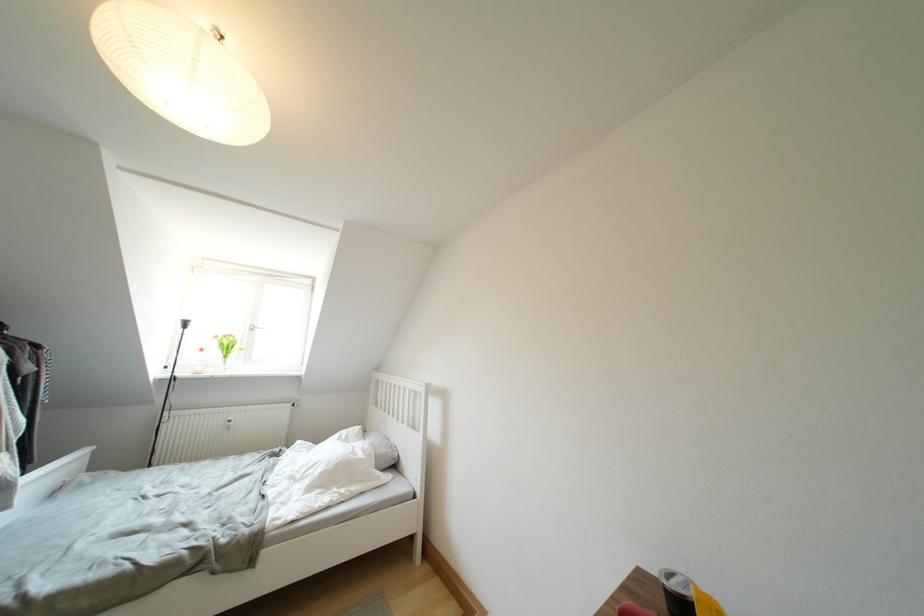
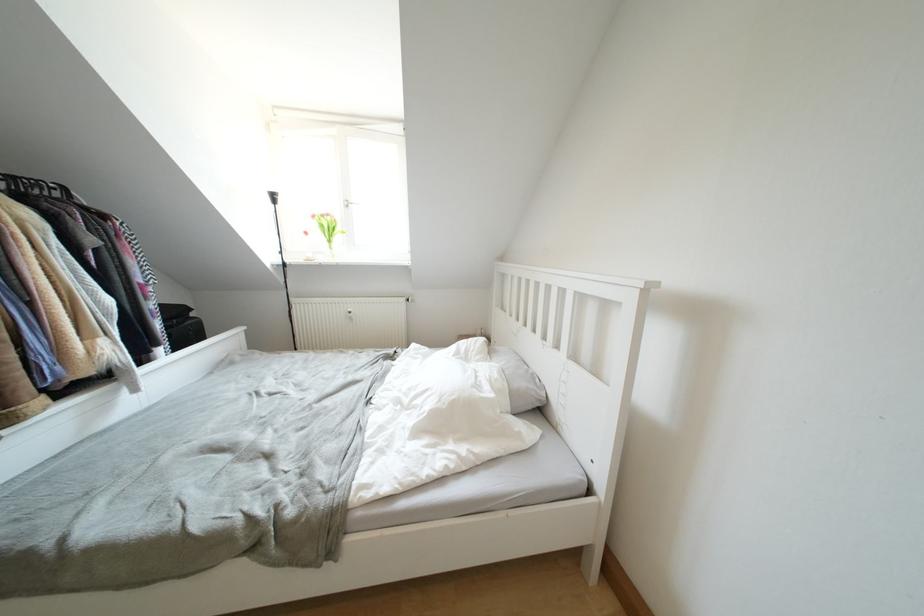
Find the pixel in the second image that matches pixel 388 454 in the first image.

(527, 387)